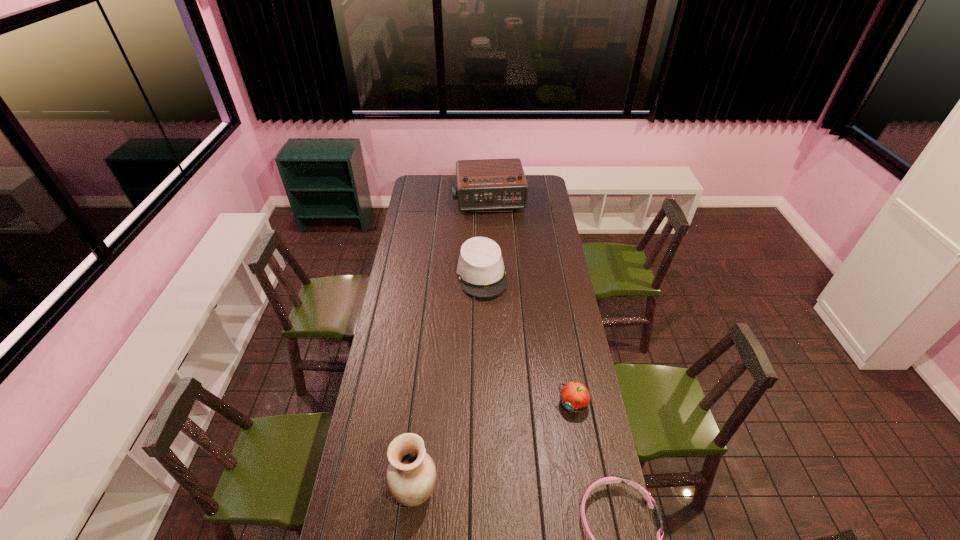
Find the location of a particular element. vacant space on the desktop that is between the tallest object and the shortest object and is positioned on the front-facing side of the hat is located at coordinates coord(540,510).

Find the location of a particular element. The height and width of the screenshot is (540, 960). free space on the desktop that is between the tallest object and the dog collar and is positioned on the tuning display of the radio receiver is located at coordinates (538, 510).

Locate an element on the screen. Image resolution: width=960 pixels, height=540 pixels. free spot on the desktop that is between the pottery and the shortest object and is positioned on the surface of the apple is located at coordinates (504, 504).